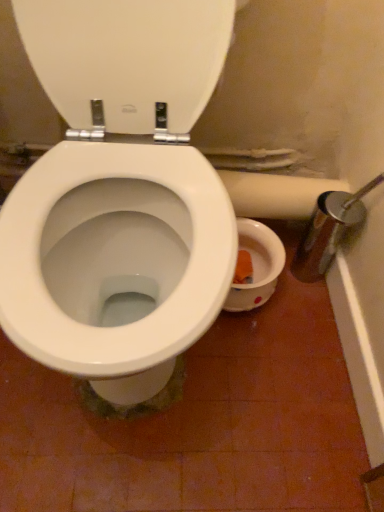
Question: Considering the relative sizes of white matte toilet paper at right and white glossy toilet seat at center in the image provided, is white matte toilet paper at right wider than white glossy toilet seat at center?

Choices:
 (A) yes
 (B) no

Answer: (A)

Question: Is white matte toilet paper at right facing towards white glossy toilet seat at center?

Choices:
 (A) no
 (B) yes

Answer: (A)

Question: From the image's perspective, does white matte toilet paper at right appear higher than white glossy toilet seat at center?

Choices:
 (A) yes
 (B) no

Answer: (B)

Question: Is white matte toilet paper at right shorter than white glossy toilet seat at center?

Choices:
 (A) yes
 (B) no

Answer: (A)

Question: Does white matte toilet paper at right appear on the right side of white glossy toilet seat at center?

Choices:
 (A) yes
 (B) no

Answer: (A)

Question: Is white matte toilet paper at right turned away from white glossy toilet seat at center?

Choices:
 (A) yes
 (B) no

Answer: (A)

Question: From the image's perspective, would you say white glossy toilet seat at center is positioned over white matte toilet paper at right?

Choices:
 (A) yes
 (B) no

Answer: (A)

Question: From the image's perspective, is white glossy toilet seat at center located beneath white matte toilet paper at right?

Choices:
 (A) no
 (B) yes

Answer: (A)

Question: Are white glossy toilet seat at center and white matte toilet paper at right located far from each other?

Choices:
 (A) yes
 (B) no

Answer: (B)

Question: Is white glossy toilet seat at center surrounding white matte toilet paper at right?

Choices:
 (A) no
 (B) yes

Answer: (A)

Question: Is white glossy toilet seat at center further to camera compared to white matte toilet paper at right?

Choices:
 (A) no
 (B) yes

Answer: (A)

Question: From a real-world perspective, is white glossy toilet seat at center beneath white matte toilet paper at right?

Choices:
 (A) no
 (B) yes

Answer: (A)

Question: From their relative heights in the image, would you say white matte toilet paper at right is taller or shorter than white glossy toilet seat at center?

Choices:
 (A) short
 (B) tall

Answer: (A)